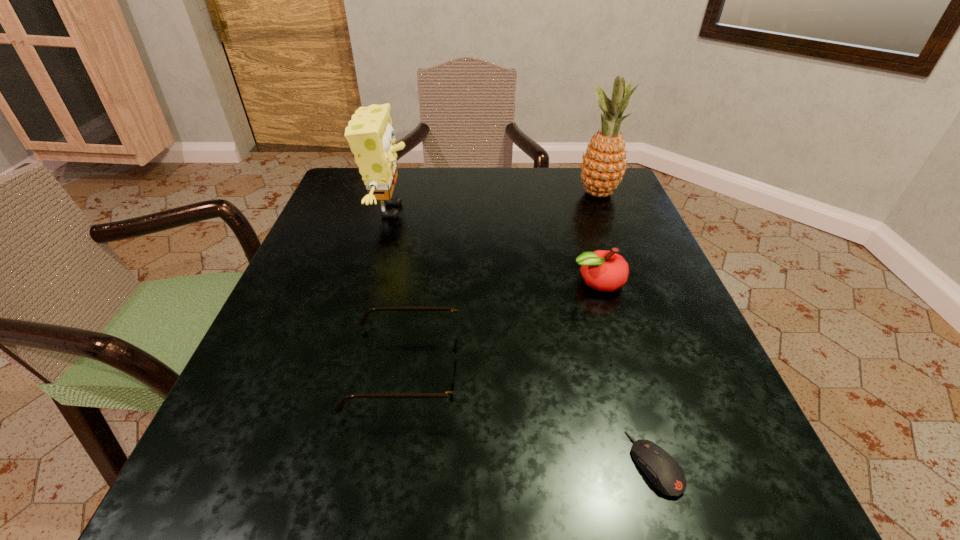
Find the location of a particular element. vacant space located 0.070m on the back of the third tallest object is located at coordinates point(587,246).

Where is `free region located at the hinge ends of the fourth tallest object`? This screenshot has width=960, height=540. free region located at the hinge ends of the fourth tallest object is located at coordinates (609, 369).

Where is `blank area located 0.070m on the back of the computer mouse`? The height and width of the screenshot is (540, 960). blank area located 0.070m on the back of the computer mouse is located at coordinates (632, 388).

At what (x,y) coordinates should I click in order to perform the action: click on pineapple that is at the far edge. Please return your answer as a coordinate pair (x, y). The width and height of the screenshot is (960, 540). Looking at the image, I should click on (604, 164).

You are a GUI agent. You are given a task and a screenshot of the screen. Output one action in this format:
    pyautogui.click(x=<x>, y=<y>)
    Task: Click on the sponge positioned at the far edge
    Image resolution: width=960 pixels, height=540 pixels.
    Given the screenshot: What is the action you would take?
    point(370,135)

The image size is (960, 540). I want to click on object located in the near edge section of the desktop, so click(x=662, y=470).

Find the location of a particular element. The image size is (960, 540). sponge that is at the left edge is located at coordinates (370, 135).

You are a GUI agent. You are given a task and a screenshot of the screen. Output one action in this format:
    pyautogui.click(x=<x>, y=<y>)
    Task: Click on the spectacles located at the left edge
    This screenshot has height=540, width=960.
    Given the screenshot: What is the action you would take?
    pyautogui.click(x=455, y=350)

The width and height of the screenshot is (960, 540). I want to click on pineapple that is at the right edge, so click(x=604, y=164).

Where is `apple located in the right edge section of the desktop`? apple located in the right edge section of the desktop is located at coordinates (602, 270).